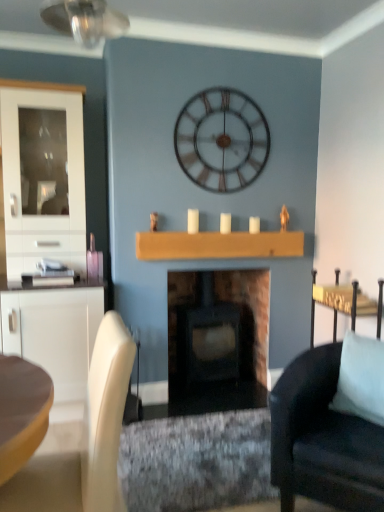
Question: Would you consider light blue fabric pillow at right to be distant from matte black wood-burning stove at center?

Choices:
 (A) no
 (B) yes

Answer: (B)

Question: Is light blue fabric pillow at right surrounding matte black wood-burning stove at center?

Choices:
 (A) no
 (B) yes

Answer: (A)

Question: From a real-world perspective, is light blue fabric pillow at right on top of matte black wood-burning stove at center?

Choices:
 (A) no
 (B) yes

Answer: (B)

Question: Does light blue fabric pillow at right turn towards matte black wood-burning stove at center?

Choices:
 (A) no
 (B) yes

Answer: (A)

Question: Is light blue fabric pillow at right looking in the opposite direction of matte black wood-burning stove at center?

Choices:
 (A) yes
 (B) no

Answer: (B)

Question: Can you confirm if light blue fabric pillow at right is wider than matte black wood-burning stove at center?

Choices:
 (A) no
 (B) yes

Answer: (A)

Question: From the image's perspective, is matte black wood-burning stove at center below white matte candle at center, which appears as the 3th candle when viewed from the left?

Choices:
 (A) no
 (B) yes

Answer: (B)

Question: Is matte black wood-burning stove at center to the left of white matte candle at center, which appears as the 3th candle when viewed from the left, from the viewer's perspective?

Choices:
 (A) yes
 (B) no

Answer: (A)

Question: Does matte black wood-burning stove at center have a greater height compared to white matte candle at center, which appears as the 3th candle when viewed from the left?

Choices:
 (A) yes
 (B) no

Answer: (A)

Question: Is white matte candle at center, which appears as the first candle when viewed from the right, completely or partially inside matte black wood-burning stove at center?

Choices:
 (A) yes
 (B) no

Answer: (B)

Question: Can you confirm if matte black wood-burning stove at center is thinner than white matte candle at center, which appears as the 3th candle when viewed from the left?

Choices:
 (A) no
 (B) yes

Answer: (A)

Question: Is matte black wood-burning stove at center to the right of white matte candle at center, which appears as the 3th candle when viewed from the left, from the viewer's perspective?

Choices:
 (A) yes
 (B) no

Answer: (B)

Question: Does white matte candle at center, positioned as the 2th candle in right-to-left order, have a greater width compared to white glossy cabinet at left?

Choices:
 (A) no
 (B) yes

Answer: (A)